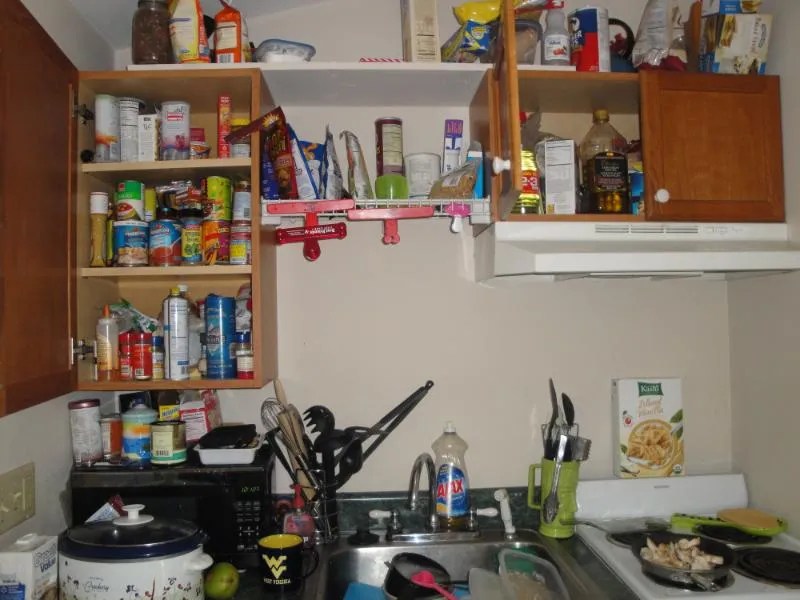
Locate an element on the screen. Image resolution: width=800 pixels, height=600 pixels. ventilation shaft is located at coordinates (641, 258).